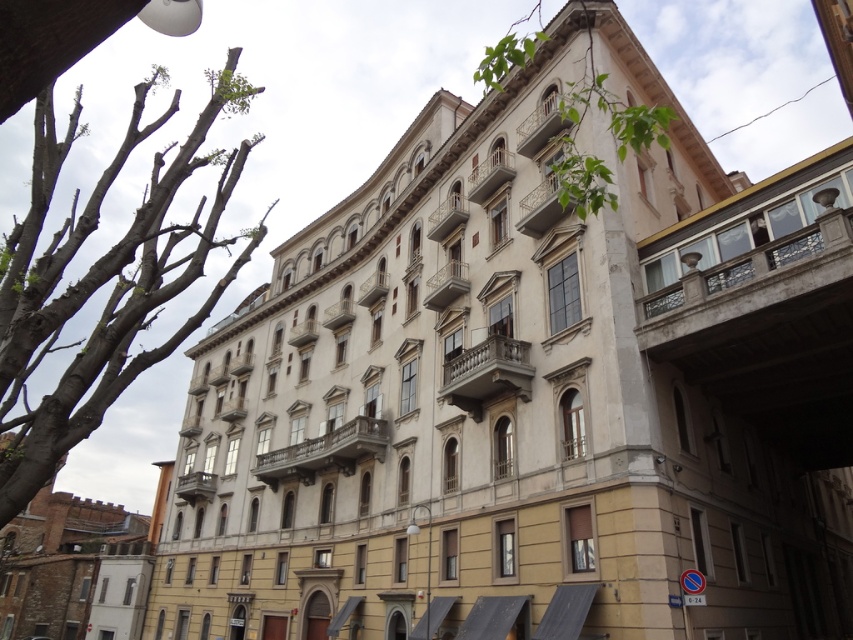
You are a landscape architect planning to plant a new tree between the bare wood tree at left and the green leafy tree at upper center. Given that the minimum spacing requirement between trees is 100 meters, will the proposed location comply with the regulations?

The distance between the bare wood tree at left and the green leafy tree at upper center is 115.25 meters, which exceeds the minimum spacing requirement of 100 meters. Therefore, the proposed location complies with the regulations.

You are standing in front of the building and want to take a photo that includes both the building and the bare wood tree at left. Based on their positions, where should you position yourself to ensure both are in the frame?

The bare wood tree at left is located at point (103, 280), so you should position yourself in a way that your camera captures both the building and the tree at that coordinate.

You are an architect analyzing the building. You notice the bare wood tree at left and the green leafy tree at upper center. Which tree would cast a bigger shadow on the building facade during midday?

The bare wood tree at left is larger in size than the green leafy tree at upper center, so it would cast a bigger shadow on the building facade during midday.